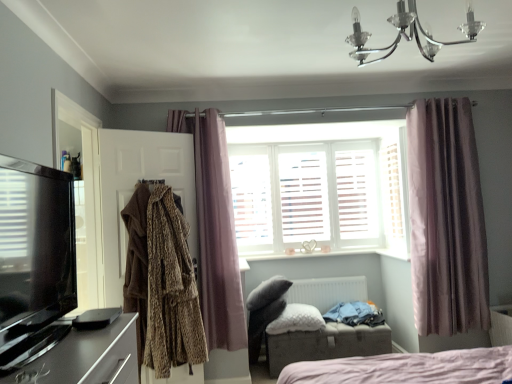
Question: Is brown textured coat at left, which is counted as the first clothing, starting from the top, oriented towards white matte radiator at center?

Choices:
 (A) no
 (B) yes

Answer: (A)

Question: From the image's perspective, is brown textured coat at left, which appears as the first clothing when viewed from the front, located above white matte radiator at center?

Choices:
 (A) yes
 (B) no

Answer: (A)

Question: Can you confirm if brown textured coat at left, which is counted as the first clothing, starting from the top, is shorter than white matte radiator at center?

Choices:
 (A) no
 (B) yes

Answer: (A)

Question: Is brown textured coat at left, the 2th clothing when ordered from right to left, thinner than white matte radiator at center?

Choices:
 (A) no
 (B) yes

Answer: (A)

Question: From a real-world perspective, is brown textured coat at left, which appears as the first clothing when viewed from the front, under white matte radiator at center?

Choices:
 (A) no
 (B) yes

Answer: (A)

Question: In terms of width, does black glossy tv at left look wider or thinner when compared to white fluffy pillow at center?

Choices:
 (A) wide
 (B) thin

Answer: (B)

Question: In terms of height, does black glossy tv at left look taller or shorter compared to white fluffy pillow at center?

Choices:
 (A) tall
 (B) short

Answer: (A)

Question: From a real-world perspective, relative to white fluffy pillow at center, is black glossy tv at left vertically above or below?

Choices:
 (A) below
 (B) above

Answer: (B)

Question: Considering their positions, is black glossy tv at left located in front of or behind white fluffy pillow at center?

Choices:
 (A) behind
 (B) front

Answer: (B)

Question: From the image's perspective, is black glossy tv at left located above or below blue cotton shirt at lower right, acting as the first clothing starting from the bottom?

Choices:
 (A) below
 (B) above

Answer: (B)

Question: Based on their sizes in the image, would you say black glossy tv at left is bigger or smaller than blue cotton shirt at lower right, which is the 2th clothing in left-to-right order?

Choices:
 (A) small
 (B) big

Answer: (B)

Question: Considering their positions, is black glossy tv at left located in front of or behind blue cotton shirt at lower right, the first clothing positioned from the back?

Choices:
 (A) front
 (B) behind

Answer: (A)

Question: Is point (79, 360) positioned closer to the camera than point (325, 317)?

Choices:
 (A) farther
 (B) closer

Answer: (B)

Question: Is brown textured coat at left, marked as the 2th clothing in a bottom-to-top arrangement, inside the boundaries of black glossy speaker at lower left, or outside?

Choices:
 (A) inside
 (B) outside

Answer: (B)

Question: Is point (160, 279) closer or farther from the camera than point (93, 324)?

Choices:
 (A) closer
 (B) farther

Answer: (B)